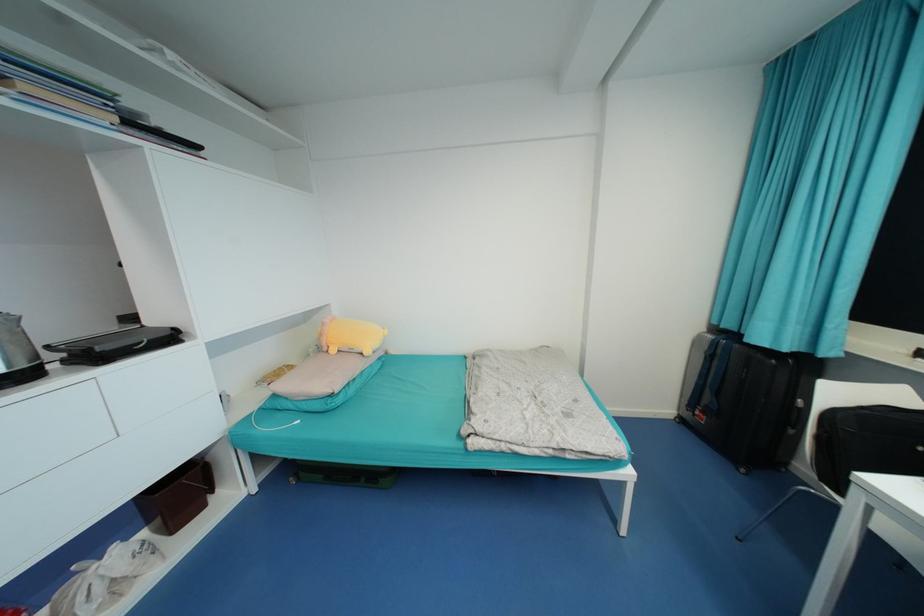
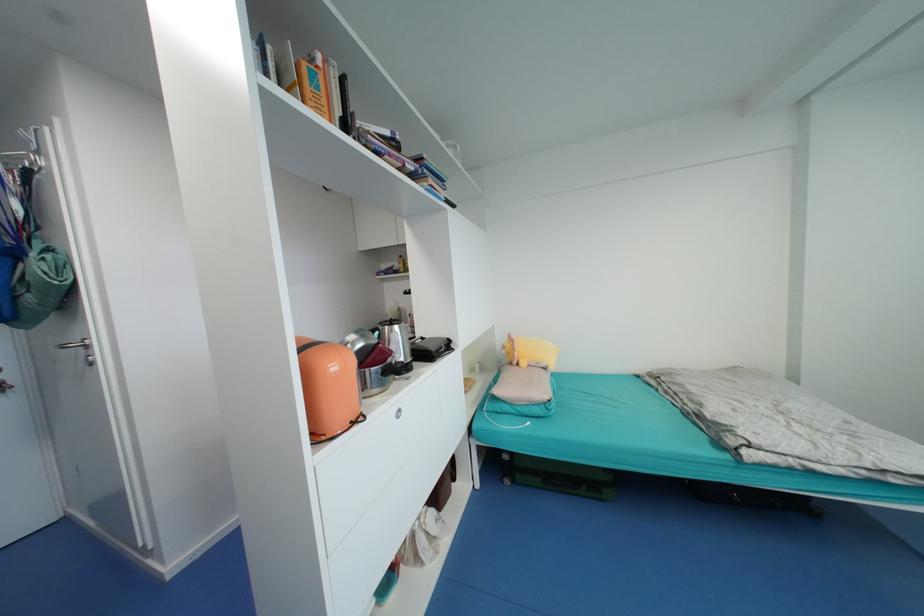
Question: Which direction would the cameraman need to move to produce the second image? Reply with the corresponding letter.

Choices:
 (A) Left
 (B) Right
 (C) Forward
 (D) Backward

Answer: (A)